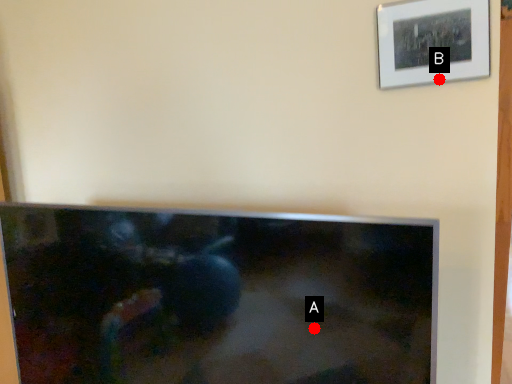
Question: Two points are circled on the image, labeled by A and B beside each circle. Which point is farther to the camera?

Choices:
 (A) A is further
 (B) B is further

Answer: (B)